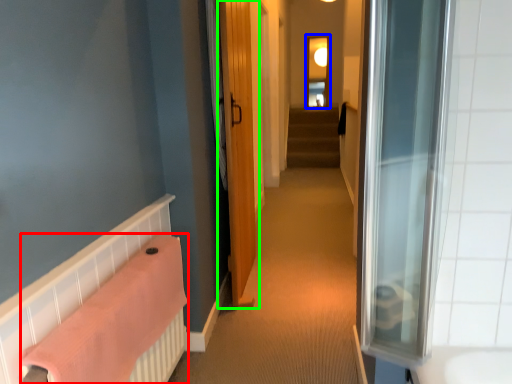
Question: Which object is the farthest from bath towel (highlighted by a red box)? Choose among these: window (highlighted by a blue box) or door (highlighted by a green box).

Choices:
 (A) window
 (B) door

Answer: (A)